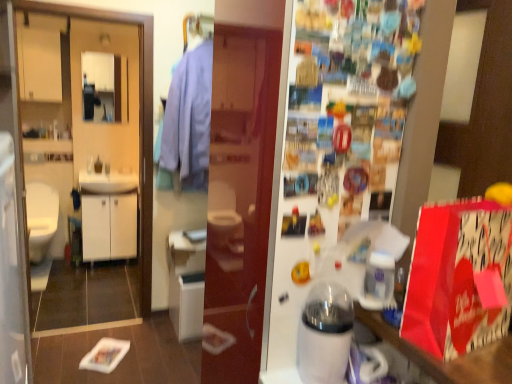
Question: Is transparent plastic screen door at left in contact with white glossy fridge at upper center?

Choices:
 (A) no
 (B) yes

Answer: (A)

Question: Considering the relative sizes of transparent plastic screen door at left and white glossy fridge at upper center in the image provided, is transparent plastic screen door at left bigger than white glossy fridge at upper center?

Choices:
 (A) yes
 (B) no

Answer: (A)

Question: Considering the relative sizes of transparent plastic screen door at left and white glossy fridge at upper center in the image provided, is transparent plastic screen door at left taller than white glossy fridge at upper center?

Choices:
 (A) no
 (B) yes

Answer: (B)

Question: Does transparent plastic screen door at left appear on the left side of white glossy fridge at upper center?

Choices:
 (A) yes
 (B) no

Answer: (A)

Question: Can you confirm if transparent plastic screen door at left is wider than white glossy fridge at upper center?

Choices:
 (A) yes
 (B) no

Answer: (A)

Question: From a real-world perspective, is transparent plastic screen door at left positioned under white glossy fridge at upper center based on gravity?

Choices:
 (A) no
 (B) yes

Answer: (B)

Question: Is white glossy sink at left positioned with its back to white matte cabinet at left, the second cabinetry positioned from the left?

Choices:
 (A) no
 (B) yes

Answer: (A)

Question: Can you confirm if white glossy sink at left is thinner than white matte cabinet at left, which ranks as the first cabinetry in right-to-left order?

Choices:
 (A) no
 (B) yes

Answer: (A)

Question: Is white glossy sink at left completely or partially outside of white matte cabinet at left, which is counted as the 2th cabinetry, starting from the top?

Choices:
 (A) no
 (B) yes

Answer: (B)

Question: Is white glossy sink at left at the left side of white matte cabinet at left, the second cabinetry positioned from the left?

Choices:
 (A) yes
 (B) no

Answer: (B)

Question: From a real-world perspective, is white glossy sink at left positioned over white matte cabinet at left, which ranks as the first cabinetry in right-to-left order, based on gravity?

Choices:
 (A) no
 (B) yes

Answer: (B)

Question: Is white glossy sink at left in front of white matte cabinet at left, placed as the first cabinetry when sorted from bottom to top?

Choices:
 (A) no
 (B) yes

Answer: (B)

Question: From the image's perspective, is light blue fabric shirt at center over white glossy humidifier at center, which ranks as the second appliance in right-to-left order?

Choices:
 (A) yes
 (B) no

Answer: (A)